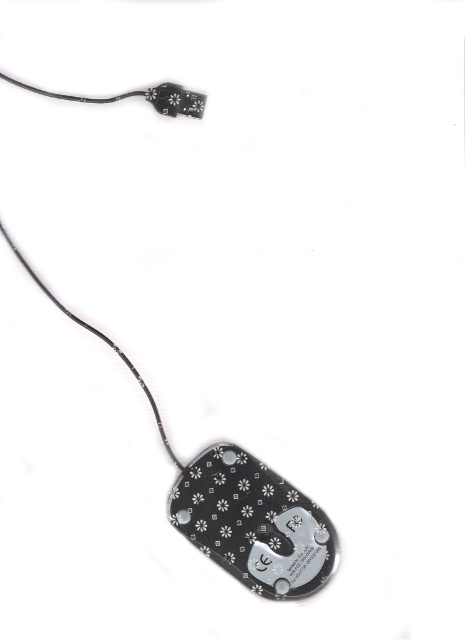
From the picture: You are setting up a new computer desk. You have a mouse pad that is 10 inches wide. The mouse pad is placed at the center of the desk. The black glossy mouse at bottom has a length of 3 inches. Can the mouse fit entirely on the mouse pad if placed along its longest side?

The black glossy mouse at bottom has a length of 3 inches, which is shorter than the 10 inch width of the mouse pad. Therefore, the mouse can fit entirely on the mouse pad if placed along its longest side.